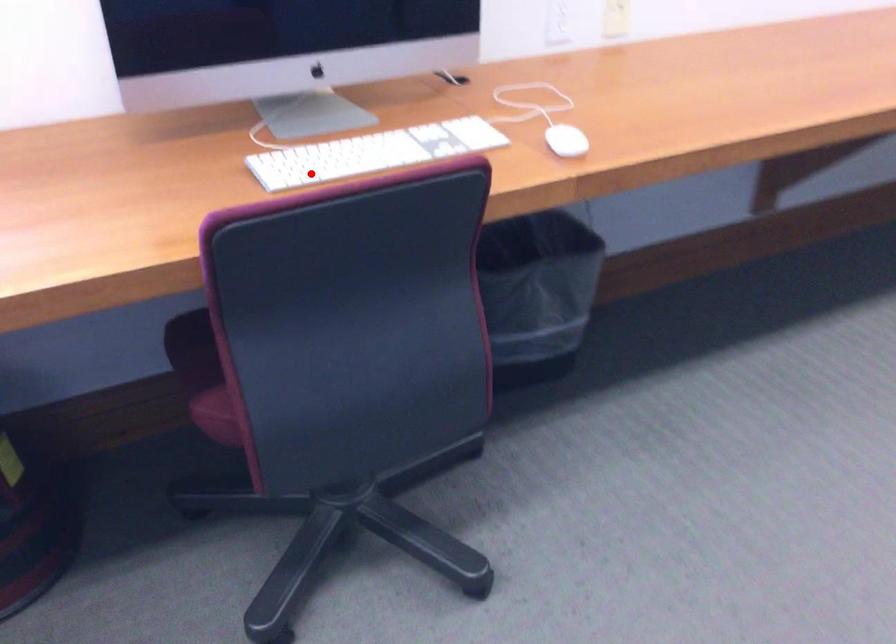
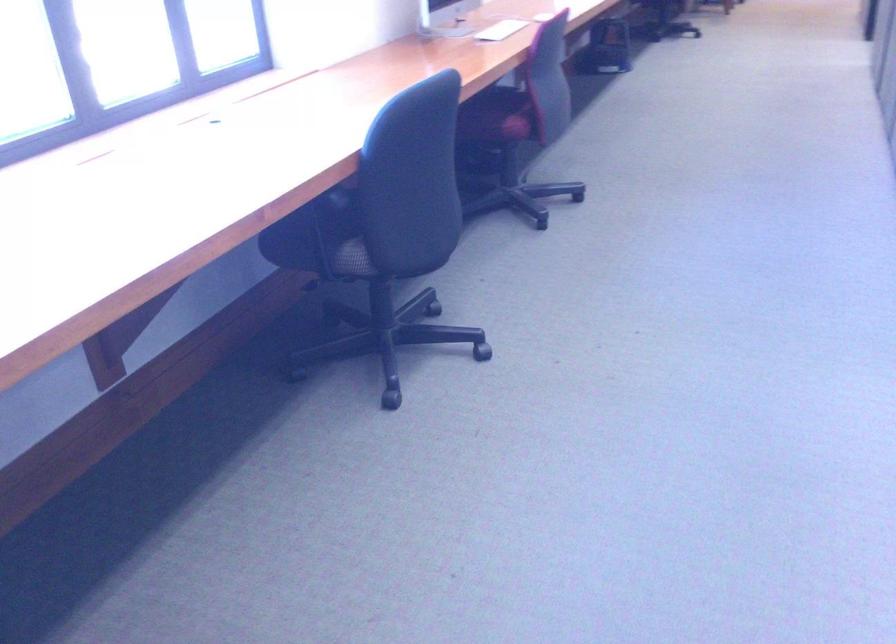
Question: I am providing you with two images of the same scene from different viewpoints. Given a red point in image1, look at the same physical point in image2. Is it:

Choices:
 (A) Closer to the viewpoint
 (B) Farther from the viewpoint

Answer: (B)